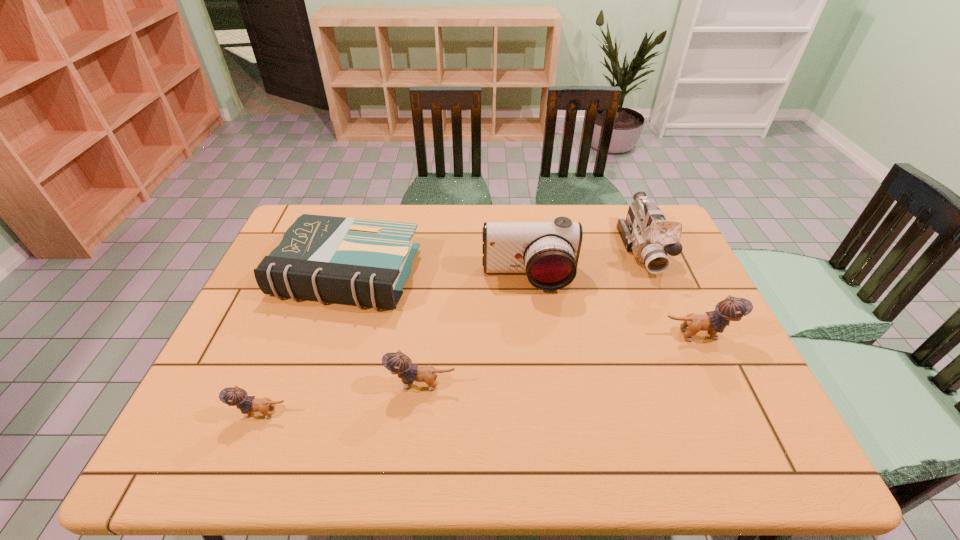
At what (x,y) coordinates should I click in order to perform the action: click on kitten at the left edge. Please return your answer as a coordinate pair (x, y). This screenshot has height=540, width=960. Looking at the image, I should click on (233, 396).

This screenshot has height=540, width=960. In order to click on paperback book that is positioned at the left edge in this screenshot , I will do point(366,262).

What are the coordinates of `kitten at the right edge` in the screenshot? It's located at (730, 309).

At what (x,y) coordinates should I click in order to perform the action: click on camcorder at the right edge. Please return your answer as a coordinate pair (x, y). Looking at the image, I should click on [646, 232].

Find the location of a particular element. This screenshot has height=540, width=960. object located in the far left corner section of the desktop is located at coordinates click(x=366, y=262).

Where is `object located in the near left corner section of the desktop`? The width and height of the screenshot is (960, 540). object located in the near left corner section of the desktop is located at coordinates (233, 396).

This screenshot has height=540, width=960. What are the coordinates of `object present at the far right corner` in the screenshot? It's located at (646, 232).

Identify the location of vacant space at the far edge of the desktop. The height and width of the screenshot is (540, 960). (398, 221).

Identify the location of free space at the near edge of the desktop. tap(331, 415).

What are the coordinates of `free region at the left edge` in the screenshot? It's located at (263, 326).